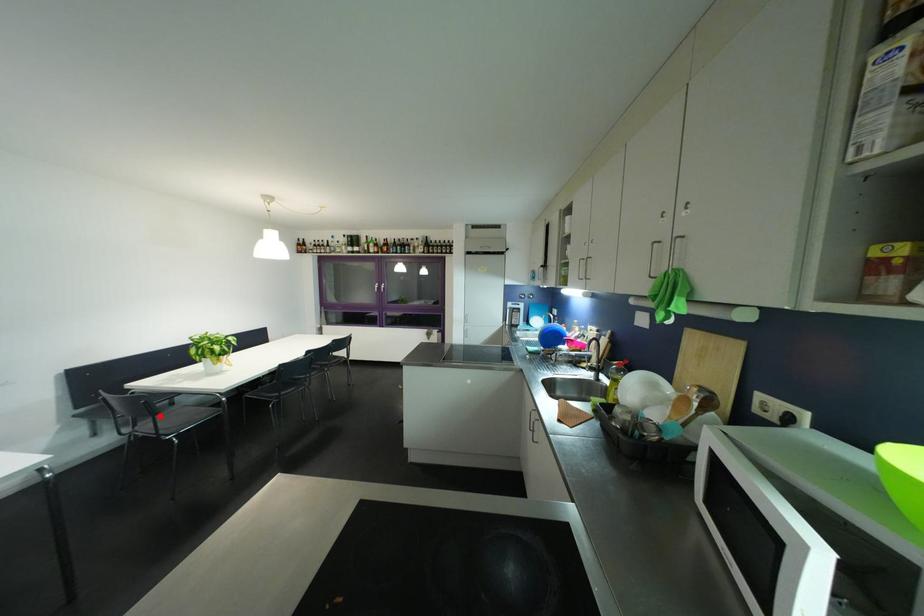
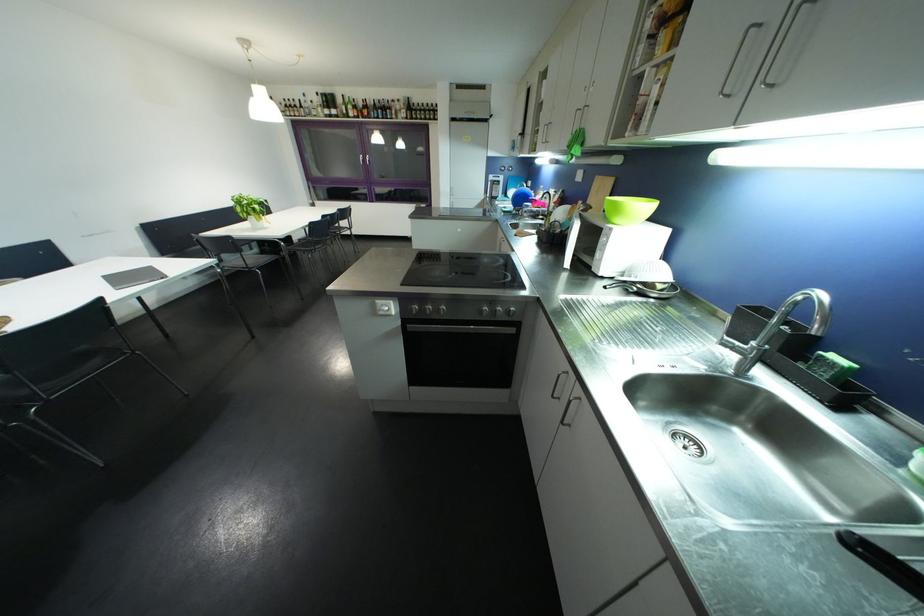
Locate, in the second image, the point that corresponds to the highlighted location in the first image.

(247, 253)